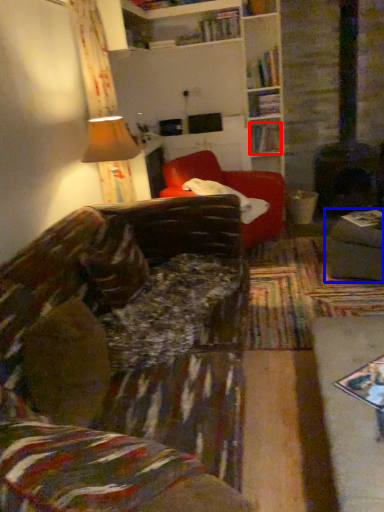
Question: Which of the following is the farthest to the observer, book (highlighted by a red box) or gray (highlighted by a blue box)?

Choices:
 (A) book
 (B) gray

Answer: (A)